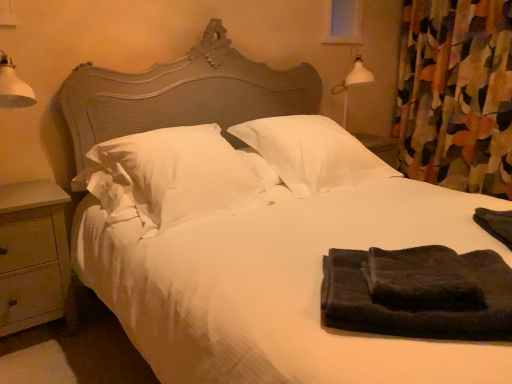
Question: Should I look upward or downward to see black terry towel at lower right, arranged as the first material when viewed from the left?

Choices:
 (A) down
 (B) up

Answer: (A)

Question: Can you confirm if white soft pillow at center, the second pillow positioned from the right, is thinner than wooden at left?

Choices:
 (A) no
 (B) yes

Answer: (A)

Question: Is white soft pillow at center, the second pillow positioned from the right, further to camera compared to wooden at left?

Choices:
 (A) yes
 (B) no

Answer: (B)

Question: Considering the relative sizes of white soft pillow at center, which is the first pillow from left to right, and wooden at left in the image provided, is white soft pillow at center, which is the first pillow from left to right, shorter than wooden at left?

Choices:
 (A) yes
 (B) no

Answer: (A)

Question: Is white soft pillow at center, which is the first pillow from left to right, looking in the opposite direction of wooden at left?

Choices:
 (A) yes
 (B) no

Answer: (B)

Question: Considering the relative sizes of white soft pillow at center, the second pillow positioned from the right, and wooden at left in the image provided, is white soft pillow at center, the second pillow positioned from the right, taller than wooden at left?

Choices:
 (A) no
 (B) yes

Answer: (A)

Question: Is white soft pillow at center, which is the first pillow from left to right, positioned before wooden at left?

Choices:
 (A) no
 (B) yes

Answer: (B)

Question: From the image's perspective, would you say black terry towel at lower right, which is the first material from front to back, is positioned over white soft pillow at center, the second pillow positioned from the right?

Choices:
 (A) no
 (B) yes

Answer: (A)

Question: Would you say black terry towel at lower right, the second material from the right, contains white soft pillow at center, which is the first pillow from left to right?

Choices:
 (A) yes
 (B) no

Answer: (B)

Question: From a real-world perspective, is black terry towel at lower right, the second material from the right, under white soft pillow at center, which is the first pillow from left to right?

Choices:
 (A) no
 (B) yes

Answer: (B)

Question: Is black terry towel at lower right, arranged as the first material when viewed from the left, to the right of white soft pillow at center, the second pillow positioned from the right, from the viewer's perspective?

Choices:
 (A) yes
 (B) no

Answer: (A)

Question: Is white soft pillow at center, the second pillow positioned from the right, at the back of black terry towel at lower right, marked as the 2th material in a back-to-front arrangement?

Choices:
 (A) yes
 (B) no

Answer: (B)

Question: Does black terry towel at lower right, which is the first material from front to back, have a larger size compared to white soft pillow at center, which is the first pillow from left to right?

Choices:
 (A) no
 (B) yes

Answer: (A)

Question: From the image's perspective, would you say wooden at left is positioned over transparent glass window screen at upper center?

Choices:
 (A) no
 (B) yes

Answer: (A)